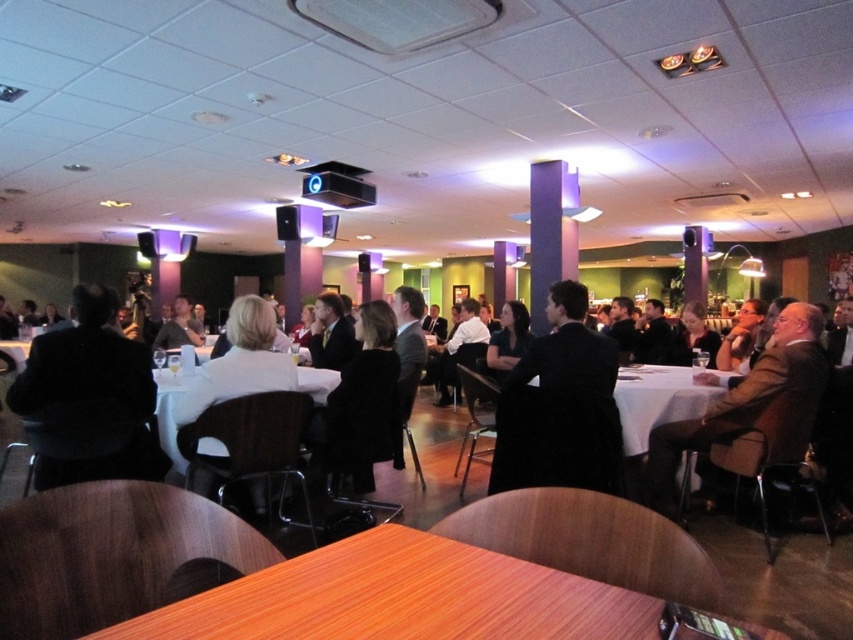
Question: Is black suit at left above white fabric table at center?

Choices:
 (A) yes
 (B) no

Answer: (A)

Question: Which point is farther to the camera?

Choices:
 (A) white matte jacket at center
 (B) black suit at left
 (C) wooden table at center

Answer: (A)

Question: Which point is farther to the camera?

Choices:
 (A) (744, 416)
 (B) (216, 380)
 (C) (311, 605)
 (D) (279, 369)

Answer: (A)

Question: In this image, where is black suit at left located relative to brown leather jacket at right?

Choices:
 (A) below
 (B) above

Answer: (B)

Question: Does wooden table at center appear on the left side of black suit at center?

Choices:
 (A) no
 (B) yes

Answer: (B)

Question: Among these points, which one is farthest from the camera?

Choices:
 (A) (320, 326)
 (B) (633, 451)
 (C) (142, 456)
 (D) (450, 554)

Answer: (A)